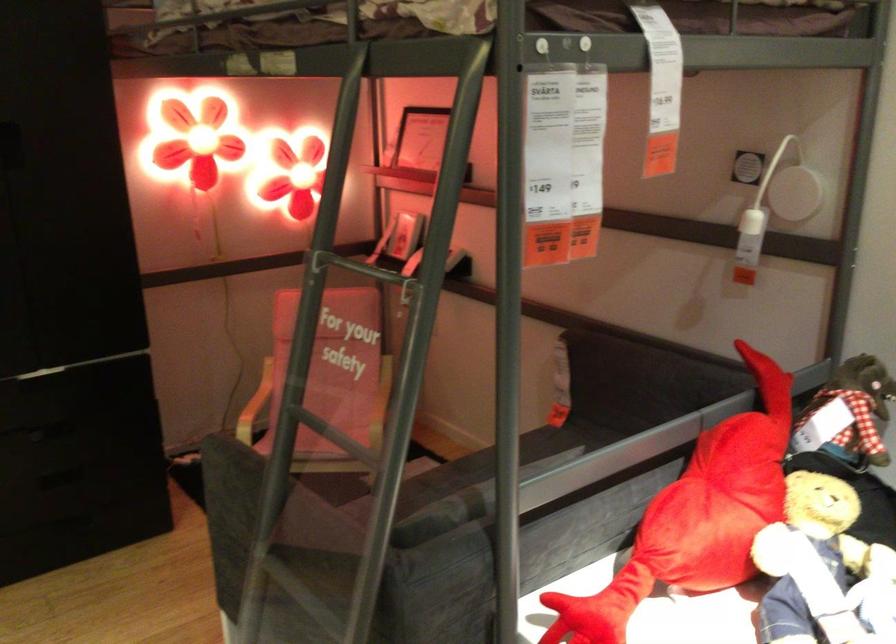
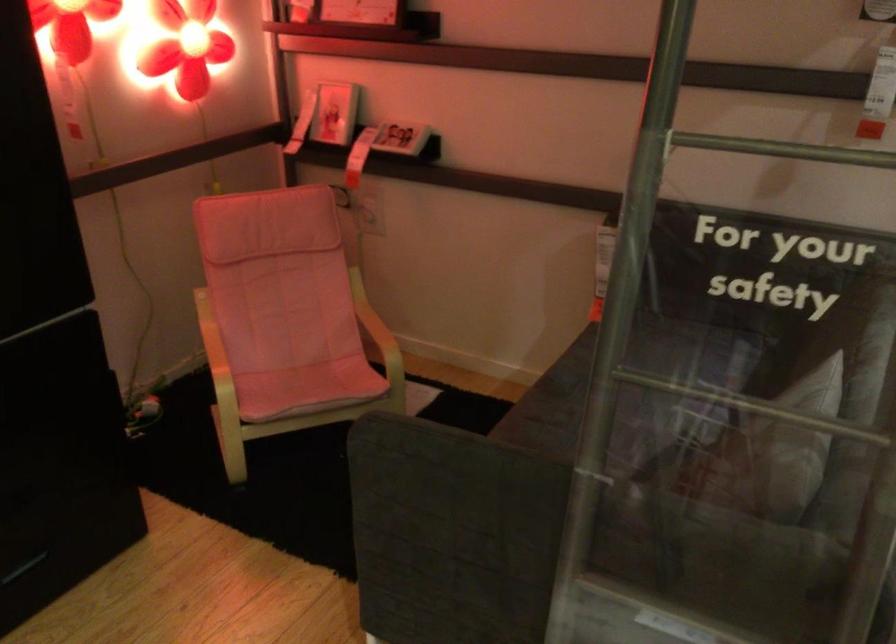
Question: The camera is either moving clockwise (left) or counter-clockwise (right) around the object. The first image is from the beginning of the video and the second image is from the end. Is the camera moving left or right when shooting the video?

Choices:
 (A) Left
 (B) Right

Answer: (A)